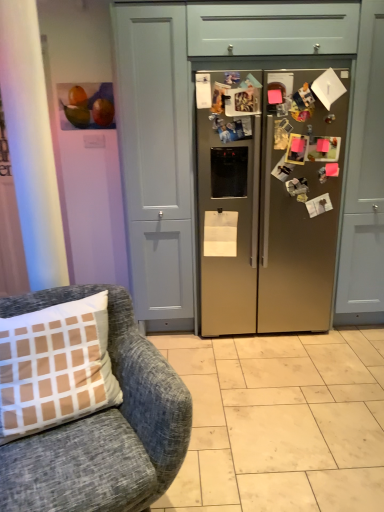
Question: From a real-world perspective, is satin metallic refrigerator at center physically above matte gray drawer at upper center?

Choices:
 (A) no
 (B) yes

Answer: (A)

Question: Would you say satin metallic refrigerator at center contains matte gray drawer at upper center?

Choices:
 (A) yes
 (B) no

Answer: (B)

Question: Is satin metallic refrigerator at center not inside matte gray drawer at upper center?

Choices:
 (A) no
 (B) yes

Answer: (B)

Question: Is satin metallic refrigerator at center looking in the opposite direction of matte gray drawer at upper center?

Choices:
 (A) yes
 (B) no

Answer: (B)

Question: Can you confirm if satin metallic refrigerator at center is bigger than matte gray drawer at upper center?

Choices:
 (A) yes
 (B) no

Answer: (A)

Question: From a real-world perspective, is satin metallic refrigerator at center below matte gray drawer at upper center?

Choices:
 (A) yes
 (B) no

Answer: (A)

Question: Is satin gold refrigerator at center at the back of textured gray fabric chair at lower left?

Choices:
 (A) no
 (B) yes

Answer: (A)

Question: Would you say textured gray fabric chair at lower left is outside satin gold refrigerator at center?

Choices:
 (A) yes
 (B) no

Answer: (A)

Question: Considering the relative sizes of textured gray fabric chair at lower left and satin gold refrigerator at center in the image provided, is textured gray fabric chair at lower left wider than satin gold refrigerator at center?

Choices:
 (A) yes
 (B) no

Answer: (B)

Question: Are textured gray fabric chair at lower left and satin gold refrigerator at center far apart?

Choices:
 (A) yes
 (B) no

Answer: (A)

Question: Is textured gray fabric chair at lower left thinner than satin gold refrigerator at center?

Choices:
 (A) no
 (B) yes

Answer: (B)

Question: Does textured gray fabric chair at lower left have a smaller size compared to satin gold refrigerator at center?

Choices:
 (A) yes
 (B) no

Answer: (A)

Question: Is satin metallic refrigerator at center oriented towards textured gray fabric chair at lower left?

Choices:
 (A) no
 (B) yes

Answer: (A)